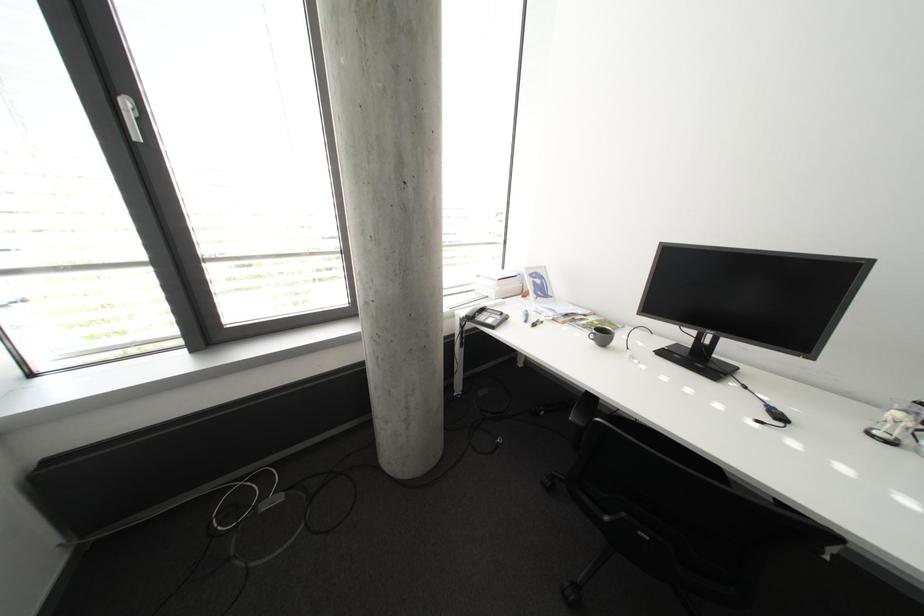
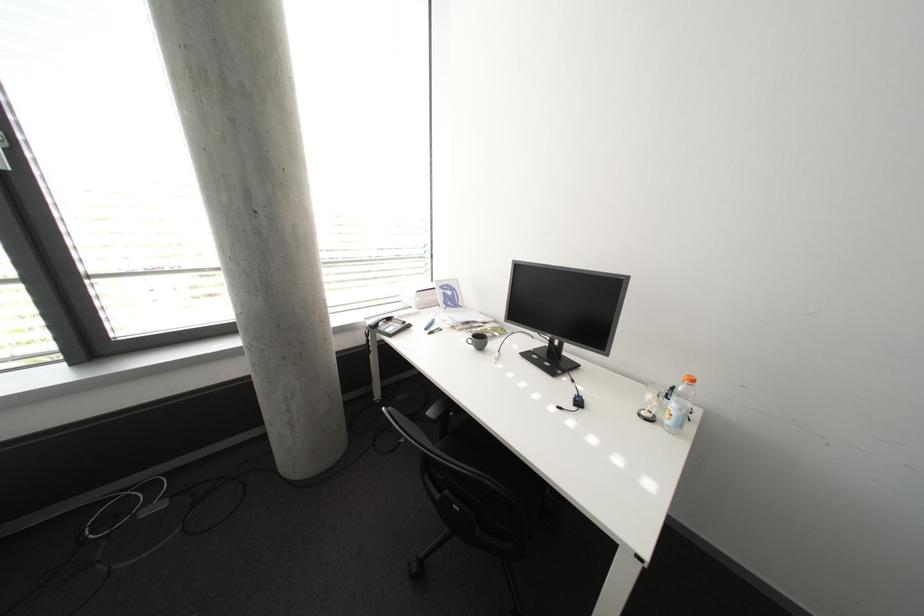
Question: The images are taken continuously from a first-person perspective. In which direction are you moving?

Choices:
 (A) Left
 (B) Right
 (C) Forward
 (D) Backward

Answer: (B)